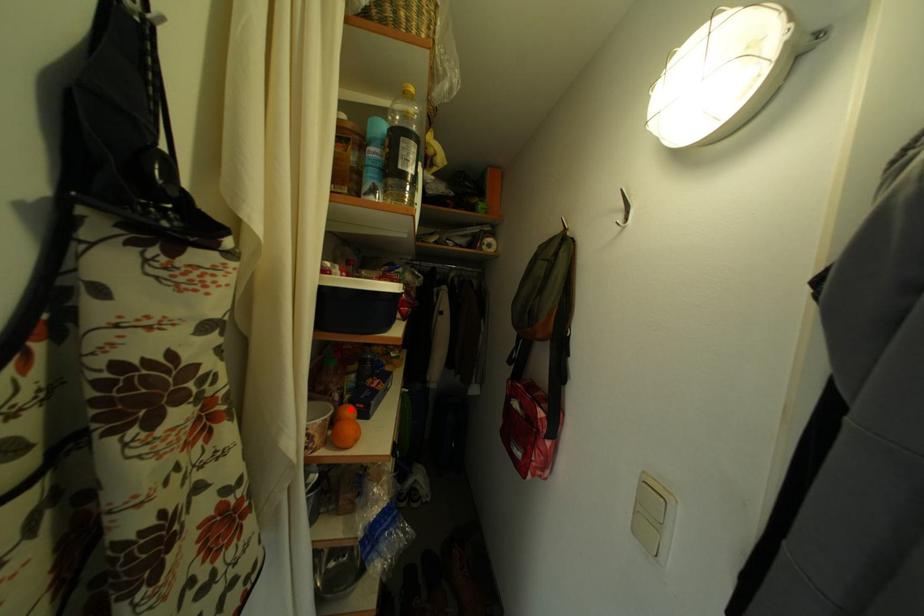
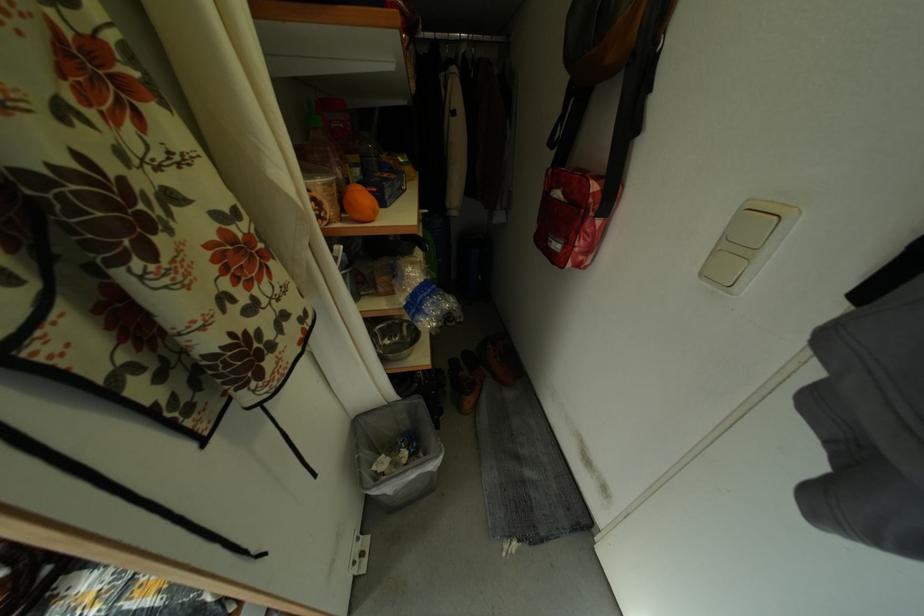
Where in the second image is the point corresponding to the highlighted location from the first image?

(357, 188)